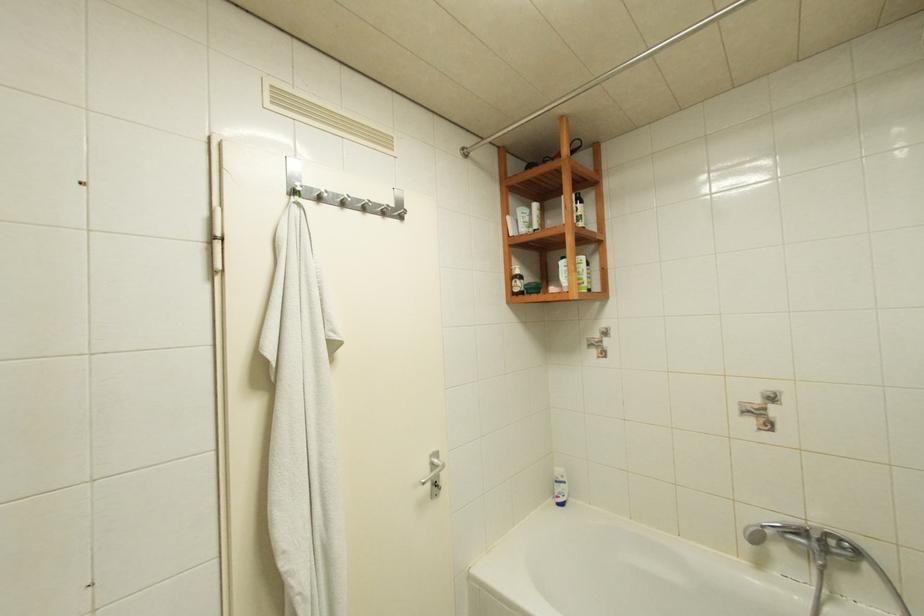
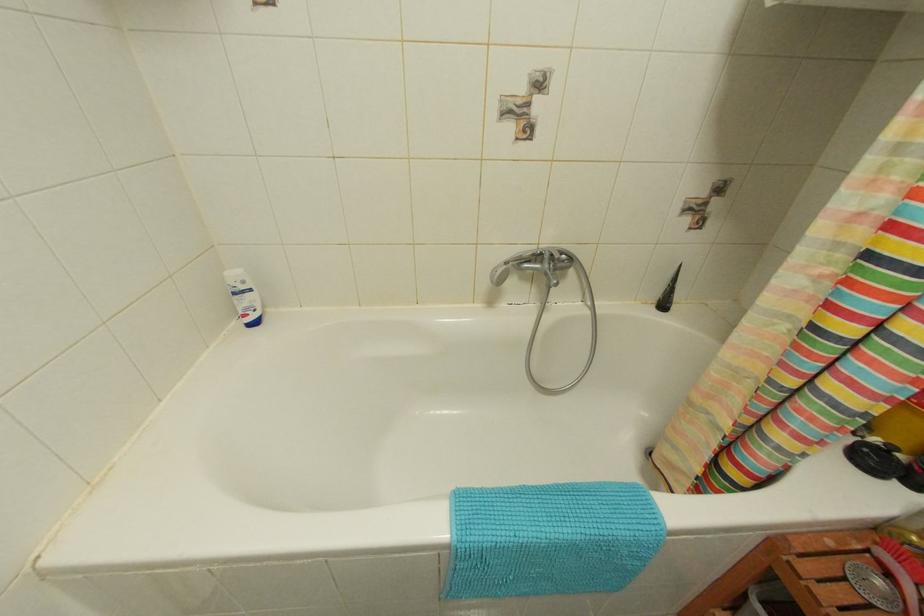
Based on the continuous images, in which direction is the camera rotating?

The camera's rotation is toward right-down.